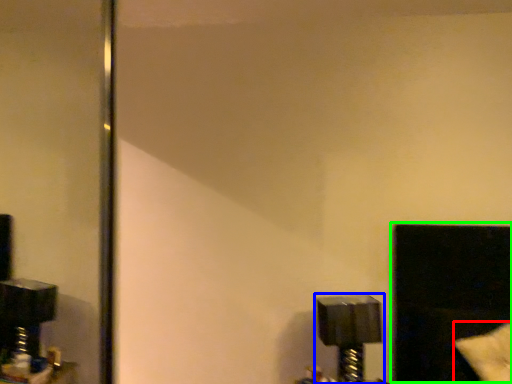
Question: Considering the real-world distances, which object is closest to pillow (highlighted by a red box)? lamp (highlighted by a blue box) or window (highlighted by a green box).

Choices:
 (A) lamp
 (B) window

Answer: (B)